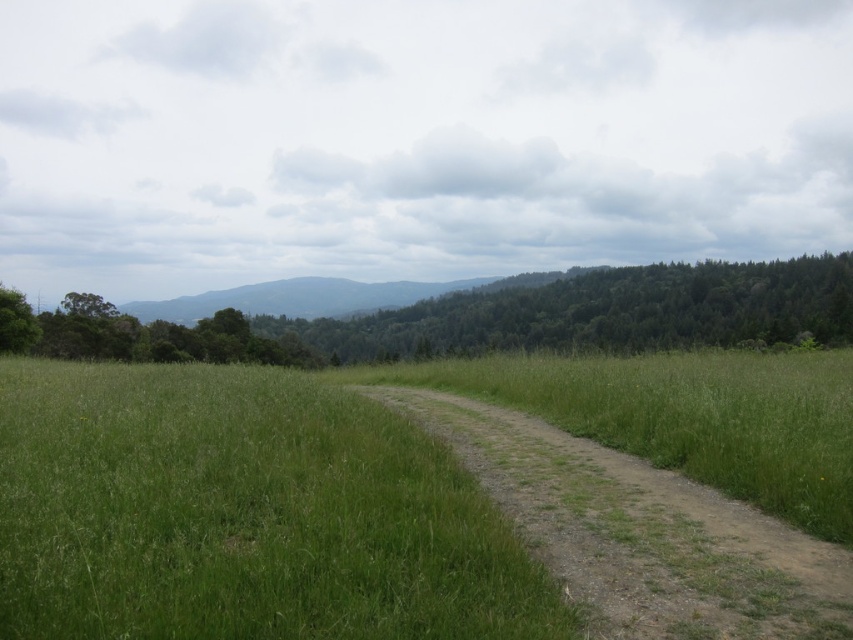
You are standing at the point marked by point (640, 531) on the dirt path in the rural landscape. Looking towards the forest in the background, which direction should you walk to stay on the dirt path?

The dirt path at center is represented by point (640, 531), so you should walk forward along the path towards the forest in the background to stay on the dirt path.